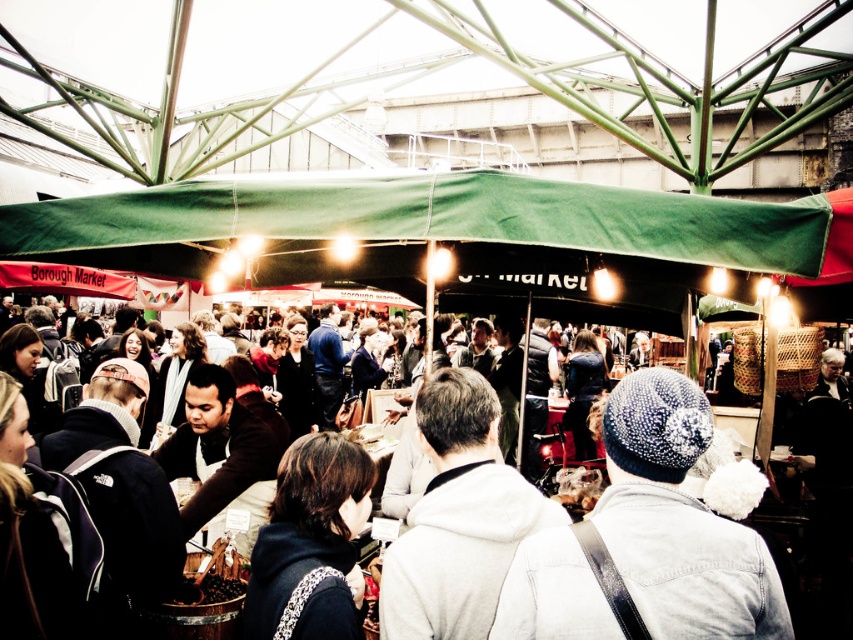
Question: Which of the following is the farthest from the observer?

Choices:
 (A) (740, 611)
 (B) (83, 257)

Answer: (B)

Question: Which object is positioned closest to the green fabric canopy at center?

Choices:
 (A) white fleece jacket at center
 (B) white knitted hat at center

Answer: (A)

Question: From the image, what is the correct spatial relationship of white knitted hat at center in relation to white fleece jacket at center?

Choices:
 (A) above
 (B) below

Answer: (B)

Question: Does green fabric canopy at center appear on the left side of white fleece jacket at center?

Choices:
 (A) no
 (B) yes

Answer: (A)

Question: Is white knitted hat at center bigger than white fleece jacket at center?

Choices:
 (A) yes
 (B) no

Answer: (B)

Question: Which object is farther from the camera taking this photo?

Choices:
 (A) white fleece jacket at center
 (B) white knitted hat at center
 (C) green fabric canopy at center

Answer: (A)